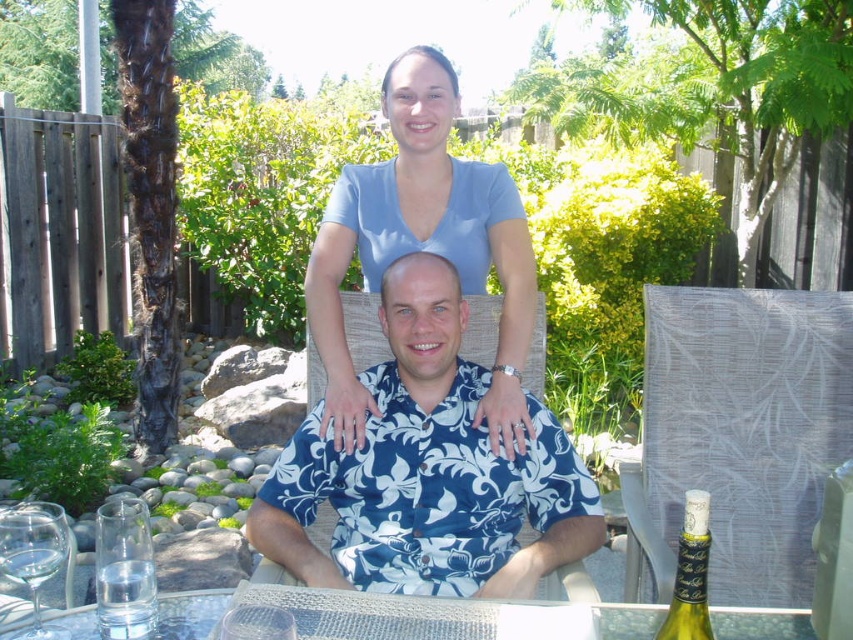
You are standing in the garden scene and want to pick up an object located at point (422, 205). If your arm can reach up to 1.8 meters, will you be able to reach it?

The distance of point (422, 205) from camera is 2.02 meters, so the object is 0.22 meters out of reach since your arm can only extend 1.8 meters.

You are setting up a picnic table for two guests. The clear glass table at center and the clear glass wine glass at lower left are part of the setup. Where should you place the wine glass relative to the table?

The clear glass wine glass at lower left should be placed to the left of the clear glass table at center, as the table is to the right of the wine glass.